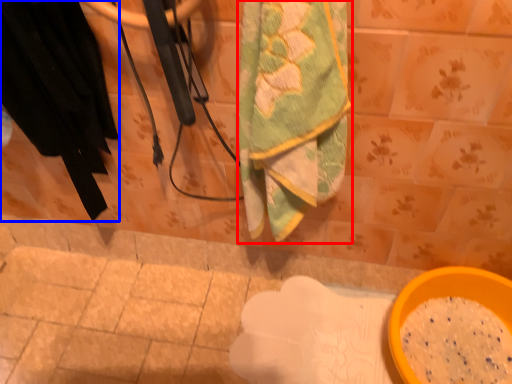
Question: Which of the following is the farthest to the observer, towel (highlighted by a red box) or clothing (highlighted by a blue box)?

Choices:
 (A) towel
 (B) clothing

Answer: (B)